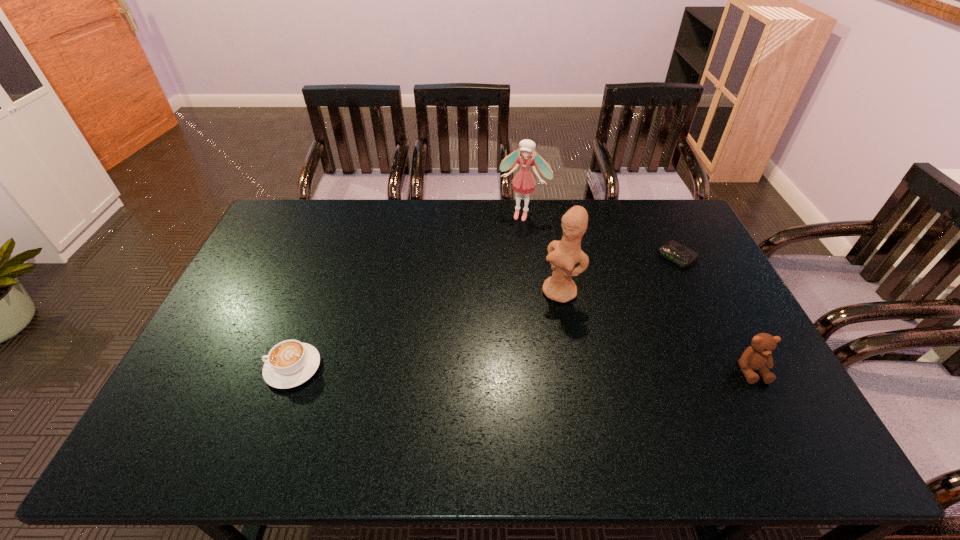
I want to click on free space between the leftmost object and the alarm clock, so click(485, 312).

I want to click on vacant point located between the fourth tallest object and the fourth nearest object, so click(485, 312).

Identify the location of the second closest object to the third nearest object. (523, 182).

Locate an element on the screen. object that is the third closest to the shortest object is located at coordinates (523, 182).